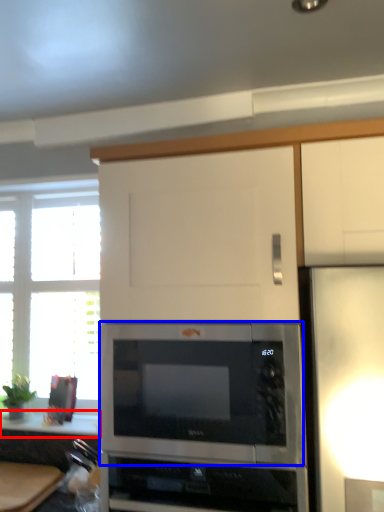
Question: Which object appears farthest to the camera in this image, counter top (highlighted by a red box) or microwave oven (highlighted by a blue box)?

Choices:
 (A) counter top
 (B) microwave oven

Answer: (A)